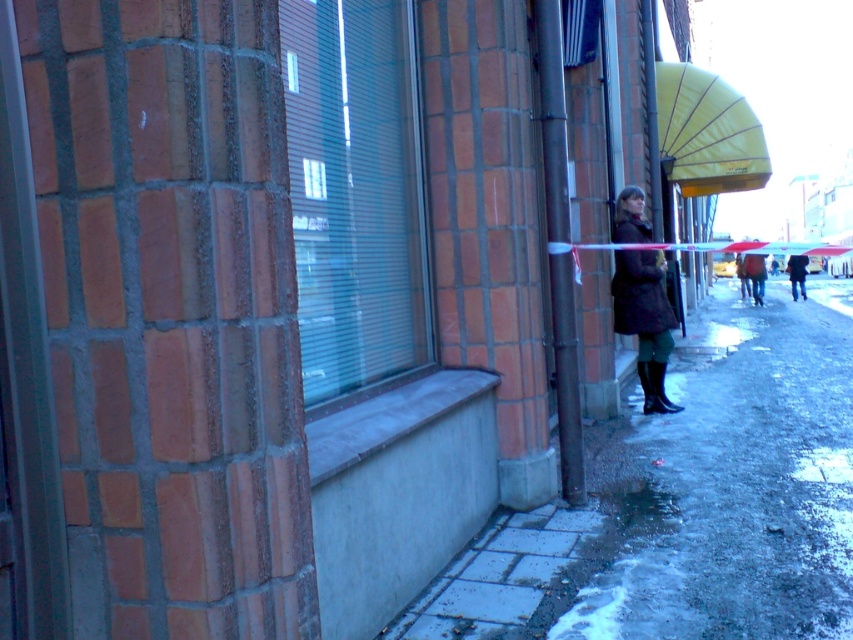
Who is more forward, [704,195] or [740,248]?

Point [704,195] is in front.

Is yellow fabric umbrella at upper right closer to camera compared to yellow matte umbrella at upper right?

Yes.

Locate an element on the screen. This screenshot has height=640, width=853. yellow fabric umbrella at upper right is located at coordinates (706, 132).

Is transparent glass window at center to the right of dark brown leather jacket at center from the viewer's perspective?

No, transparent glass window at center is not to the right of dark brown leather jacket at center.

Which is behind, point (383, 86) or point (753, 289)?

The point (753, 289) is more distant.

Locate an element on the screen. Image resolution: width=853 pixels, height=640 pixels. transparent glass window at center is located at coordinates (355, 193).

Who is more distant from viewer, (743,269) or (738,250)?

Positioned behind is point (738,250).

Who is more forward, (x=752, y=285) or (x=738, y=250)?

Point (x=752, y=285) is more forward.

Is point (759, 259) positioned in front of point (749, 248)?

Yes, it is.

Locate an element on the screen. dark brown leather jacket at center is located at coordinates (755, 275).